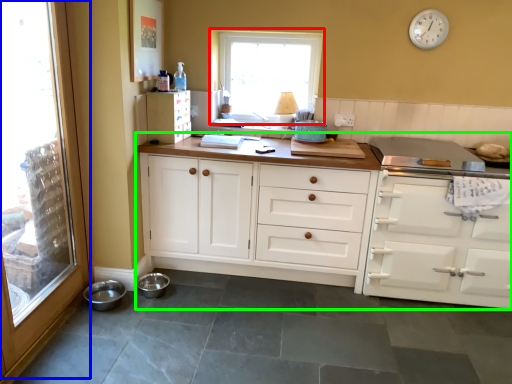
Question: Estimate the real-world distances between objects in this image. Which object is closer to window (highlighted by a red box), glass door (highlighted by a blue box) or cabinetry (highlighted by a green box)?

Choices:
 (A) glass door
 (B) cabinetry

Answer: (B)